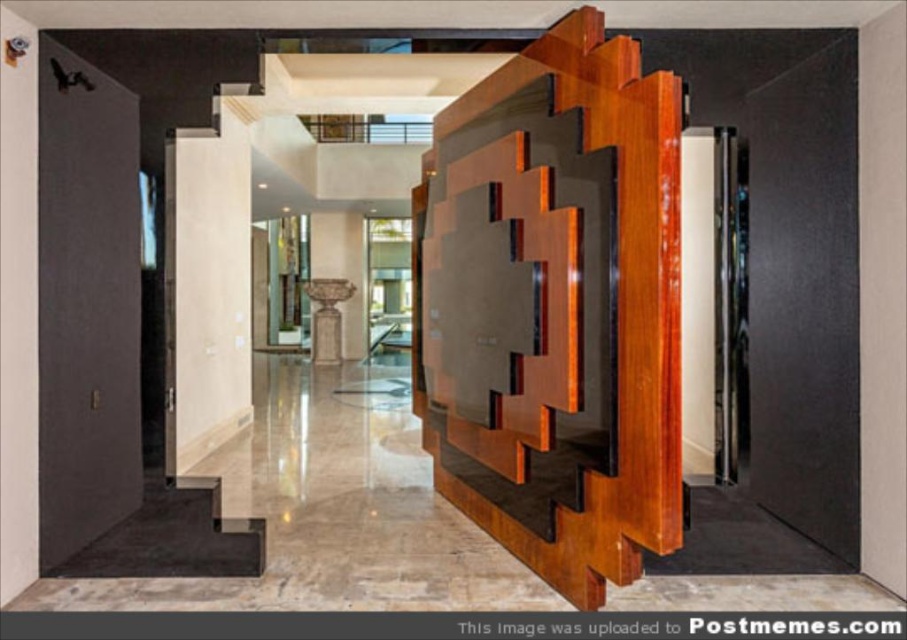
Question: Can you confirm if matte black door at left is thinner than light wood door at center?

Choices:
 (A) no
 (B) yes

Answer: (A)

Question: Does shiny brown wood at center have a larger size compared to matte black door at left?

Choices:
 (A) yes
 (B) no

Answer: (A)

Question: Which of the following is the farthest from the observer?

Choices:
 (A) (183, 445)
 (B) (96, 211)
 (C) (525, 452)

Answer: (A)

Question: Based on their relative distances, which object is farther from the light wood door at center?

Choices:
 (A) shiny brown wood at center
 (B) matte black door at left

Answer: (A)

Question: Considering the real-world distances, which object is farthest from the light wood door at center?

Choices:
 (A) shiny brown wood at center
 (B) matte black door at left

Answer: (A)

Question: Is matte black door at left positioned in front of light wood door at center?

Choices:
 (A) no
 (B) yes

Answer: (B)